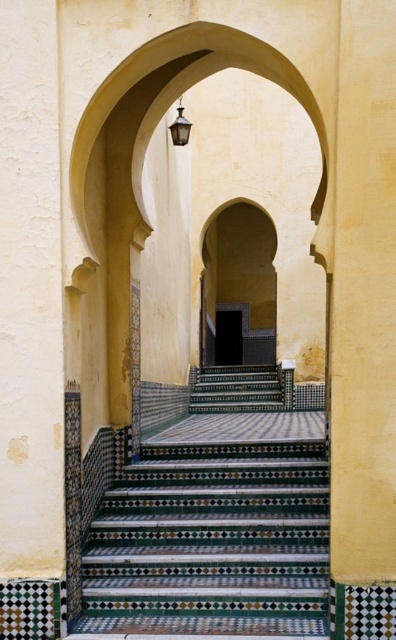
Between mosaic tile stairs at center and multicolored mosaic stairs at center, which one has less height?

mosaic tile stairs at center

Describe the element at coordinates (211, 544) in the screenshot. I see `mosaic tile stairs at center` at that location.

Where is `mosaic tile stairs at center`? mosaic tile stairs at center is located at coordinates (211, 544).

Is smooth beige arch at center in front of multicolored mosaic stairs at center?

No, it is behind multicolored mosaic stairs at center.

Can you confirm if smooth beige arch at center is shorter than multicolored mosaic stairs at center?

No.

Where is `smooth beige arch at center`? The height and width of the screenshot is (640, 396). smooth beige arch at center is located at coordinates (239, 280).

This screenshot has width=396, height=640. Find the location of `smooth beige arch at center`. smooth beige arch at center is located at coordinates (239, 280).

Is mosaic tile stairs at center smaller than smooth beige arch at center?

Yes, mosaic tile stairs at center is smaller than smooth beige arch at center.

Identify the location of mosaic tile stairs at center. The height and width of the screenshot is (640, 396). pyautogui.click(x=211, y=544).